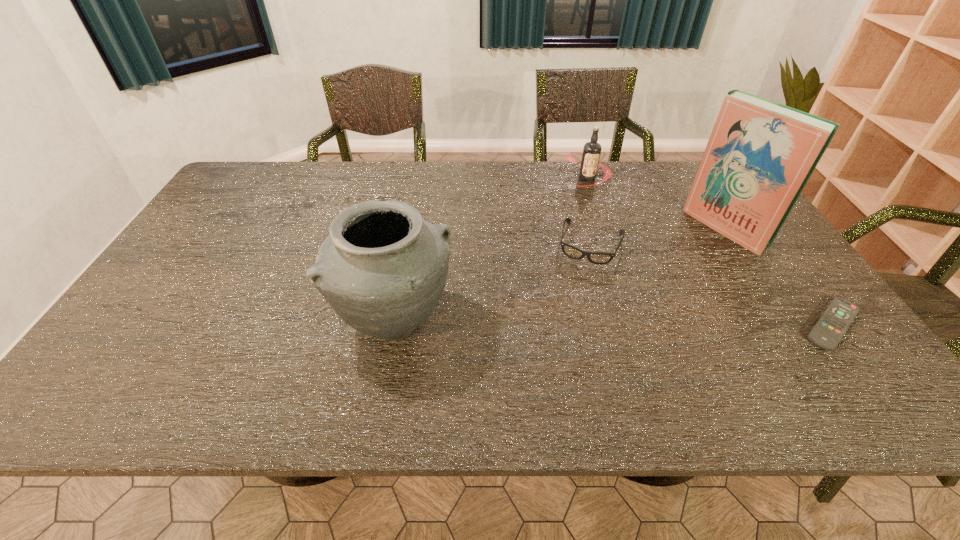
Identify which object is the fourth closest to the urn. Please provide its 2D coordinates. Your answer should be formatted as a tuple, i.e. [(x, y)], where the tuple contains the x and y coordinates of a point satisfying the conditions above.

[(828, 331)]

Where is `object that is the fourth closest one to the remote control`? The image size is (960, 540). object that is the fourth closest one to the remote control is located at coordinates (382, 268).

I want to click on free space that satisfies the following two spatial constraints: 1. on the front side of the third shortest object; 2. on the right side of the shortest object, so click(636, 325).